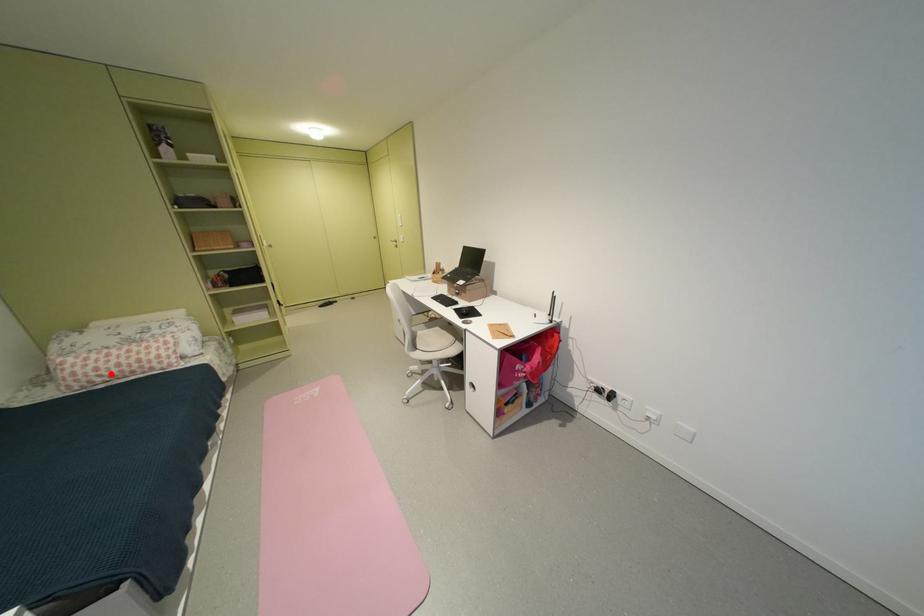
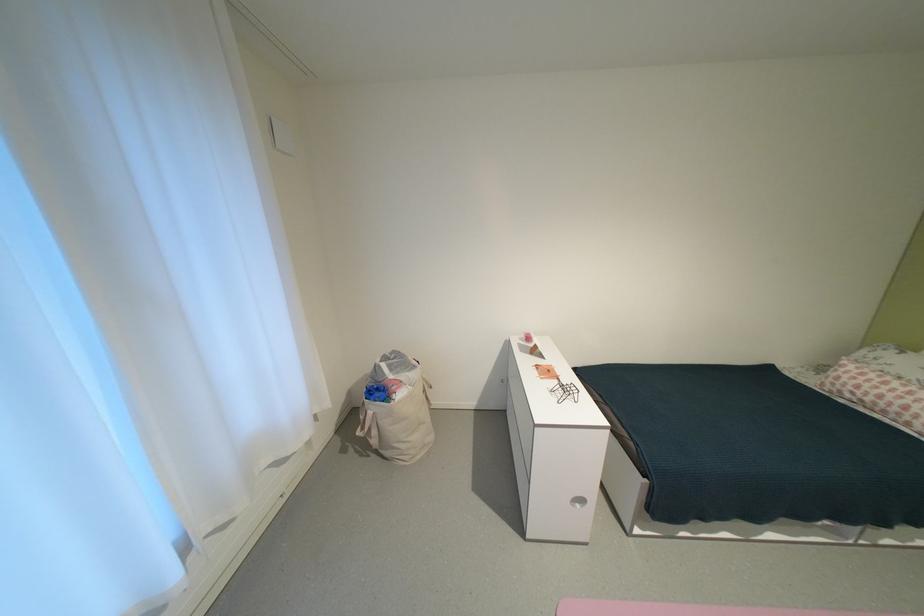
Question: I am providing you with two images of the same scene from different viewpoints. Given a red point in image1, look at the same physical point in image2. Is it:

Choices:
 (A) Closer to the viewpoint
 (B) Farther from the viewpoint

Answer: (B)